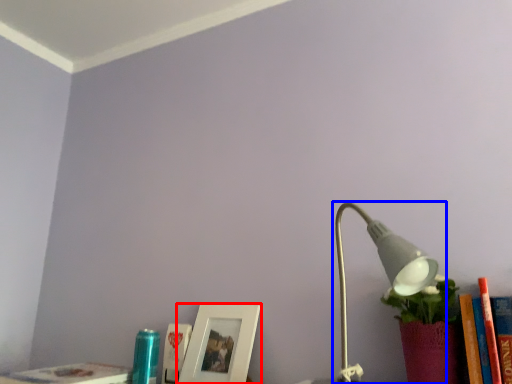
Question: Which object appears farthest to the camera in this image, picture frame (highlighted by a red box) or lamp (highlighted by a blue box)?

Choices:
 (A) picture frame
 (B) lamp

Answer: (A)